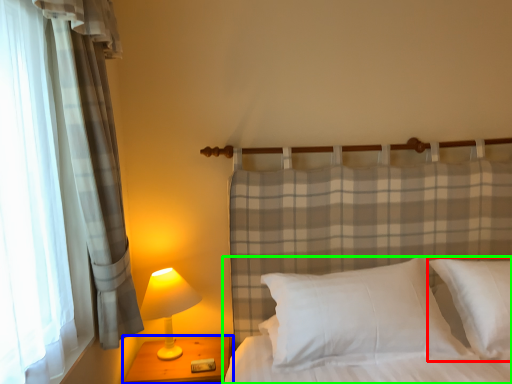
Question: Considering the real-world distances, which object is closest to pillow (highlighted by a red box)? nightstand (highlighted by a blue box) or bed (highlighted by a green box).

Choices:
 (A) nightstand
 (B) bed

Answer: (B)